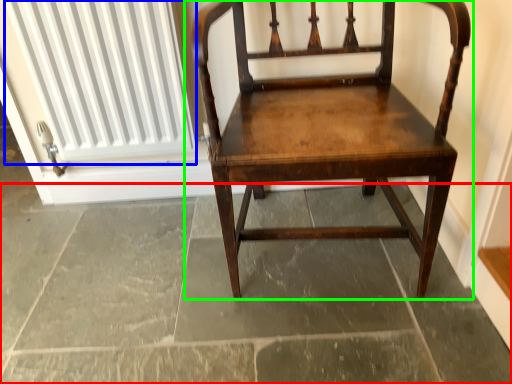
Question: Estimate the real-world distances between objects in this image. Which object is closer to concrete (highlighted by a red box), radiator (highlighted by a blue box) or chair (highlighted by a green box)?

Choices:
 (A) radiator
 (B) chair

Answer: (B)